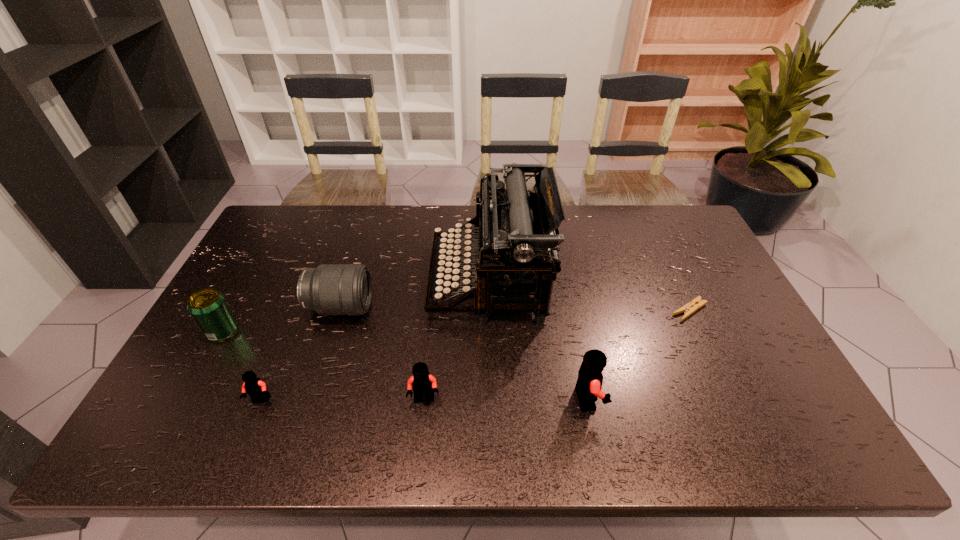
You are a GUI agent. You are given a task and a screenshot of the screen. Output one action in this format:
    pyautogui.click(x=<x>, y=<y>)
    Task: Click on the empty space between the sixth object from left to right and the leftmost object
    The height and width of the screenshot is (540, 960).
    Given the screenshot: What is the action you would take?
    pyautogui.click(x=405, y=365)

In order to click on vacant point located between the telephoto lens and the sixth tallest object in this screenshot , I will do `click(300, 354)`.

I want to click on free space between the sixth tallest object and the beer can, so click(242, 366).

You are a GUI agent. You are given a task and a screenshot of the screen. Output one action in this format:
    pyautogui.click(x=<x>, y=<y>)
    Task: Click on the free space between the telephoto lens and the tallest object
    The width and height of the screenshot is (960, 540).
    Given the screenshot: What is the action you would take?
    415,294

This screenshot has height=540, width=960. Find the location of `the fourth closest object to the sixth tallest object`. the fourth closest object to the sixth tallest object is located at coordinates (512, 225).

Identify the location of object that ranks as the third closest to the second shortest object. (421, 382).

The height and width of the screenshot is (540, 960). Identify the location of Lego object that ranks as the third closest to the shortest object. (254, 387).

The image size is (960, 540). In order to click on Lego that stands as the third closest to the telephoto lens in this screenshot , I will do `click(588, 387)`.

The image size is (960, 540). In order to click on vacant space that satisfies the following two spatial constraints: 1. on the front-facing side of the tallest Lego; 2. on the front-facing side of the second shortest Lego in this screenshot , I will do `click(588, 399)`.

The width and height of the screenshot is (960, 540). Identify the location of vacant position in the image that satisfies the following two spatial constraints: 1. on the surface of the telephoto lens; 2. on the front-facing side of the shortest Lego. (311, 400).